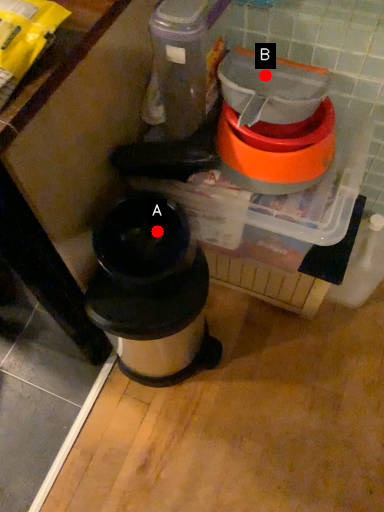
Question: Two points are circled on the image, labeled by A and B beside each circle. Which point is closer to the camera taking this photo?

Choices:
 (A) A is closer
 (B) B is closer

Answer: (B)